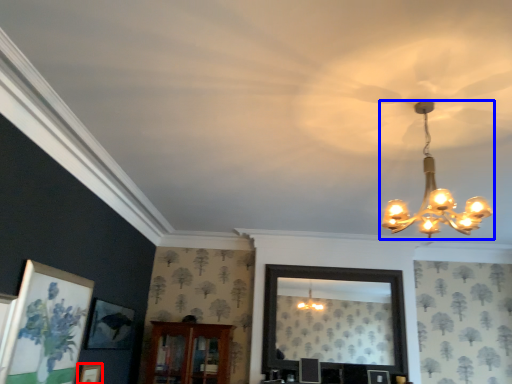
Question: Among these objects, which one is nearest to the camera, picture frame (highlighted by a red box) or lamp (highlighted by a blue box)?

Choices:
 (A) picture frame
 (B) lamp

Answer: (B)